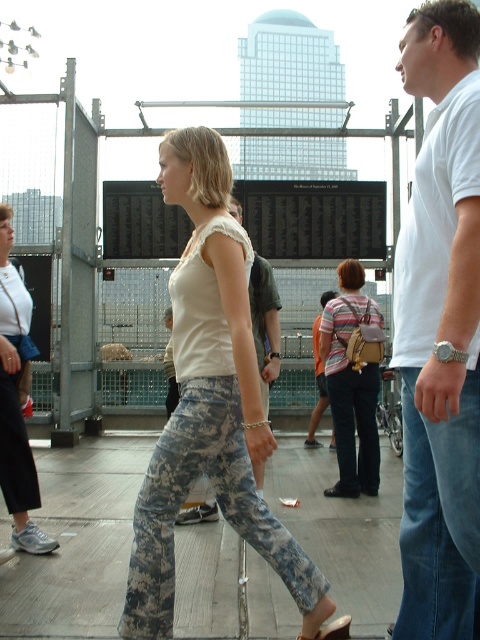
You are a photographer trying to capture a shot of the striped fabric backpack at center and the camouflage pants at lower left. Based on their positions, which object is closer to the camera?

The striped fabric backpack at center is below camouflage pants at lower left, meaning the camouflage pants at lower left are closer to the camera.

Based on the scene description, where is the camouflage pants at center located in terms of coordinates?

The camouflage pants at center is located at coordinates point [78,541].

You are an observer looking at the scene. You notice the camouflage fabric pants at center and the camouflage fabric sandal at lower center. Which object appears taller in the image?

The camouflage fabric pants at center appears much taller than the camouflage fabric sandal at lower center according to the description.